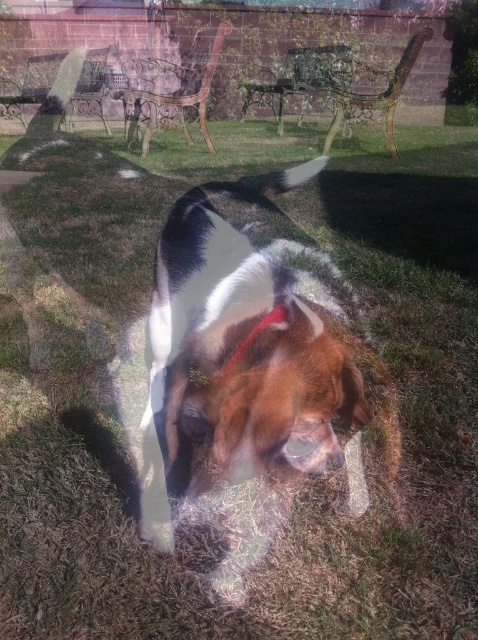
Question: Is brown and white fur dog at center closer to camera compared to red fabric neckband at center?

Choices:
 (A) yes
 (B) no

Answer: (A)

Question: Which of the following is the closest to the observer?

Choices:
 (A) (249, 333)
 (B) (307, 285)

Answer: (A)

Question: Can you confirm if brown and white fur dog at center is smaller than red fabric neckband at center?

Choices:
 (A) yes
 (B) no

Answer: (B)

Question: From the image, what is the correct spatial relationship of brown and white fur dog at center in relation to red fabric neckband at center?

Choices:
 (A) left
 (B) right

Answer: (B)